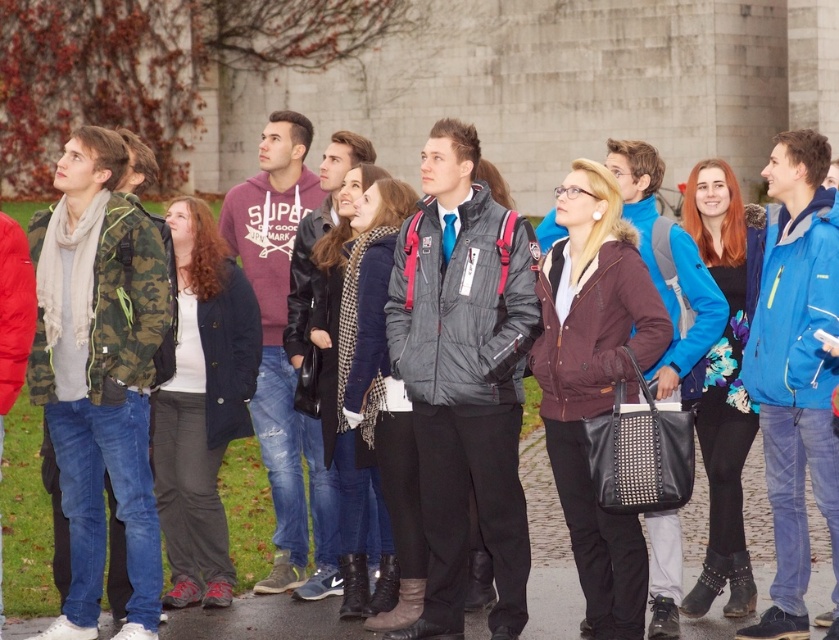
You are part of the tour group and want to locate the burgundy leather jacket at center and the dark blue cotton jacket at center. Which one is closer to the front of the group?

The burgundy leather jacket at center is closer to the front of the group because it is positioned under the dark blue cotton jacket at center, meaning it is in front.

You are a photographer trying to capture a photo of the group where both the burgundy leather jacket at center and the dark blue cotton jacket at center are visible. Since you want to ensure both are fully in frame, which jacket should you focus on to avoid cropping the shorter one?

The burgundy leather jacket at center is taller than the dark blue cotton jacket at center, so focusing on the taller burgundy leather jacket at center ensures the shorter dark blue cotton jacket at center will also be fully visible.